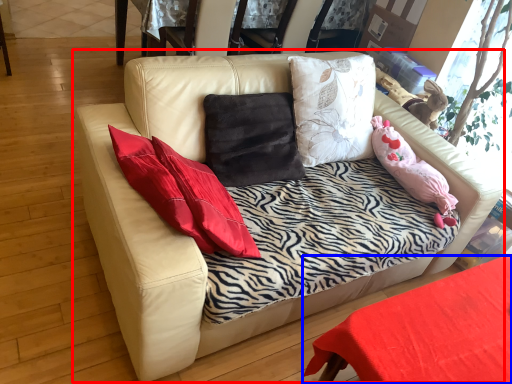
Question: Which point is further to the camera, studio couch (highlighted by a red box) or table (highlighted by a blue box)?

Choices:
 (A) studio couch
 (B) table

Answer: (B)